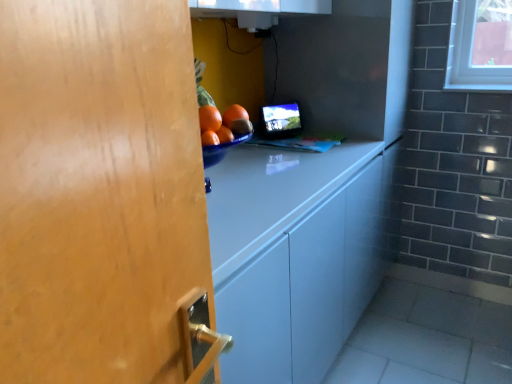
Question: Is point (287, 125) positioned closer to the camera than point (254, 170)?

Choices:
 (A) closer
 (B) farther

Answer: (B)

Question: Do you think matte black monitor at center is within white glossy cabinet at center, or outside of it?

Choices:
 (A) outside
 (B) inside

Answer: (A)

Question: Considering the relative positions of matte black monitor at center and white glossy cabinet at center in the image provided, is matte black monitor at center to the left or to the right of white glossy cabinet at center?

Choices:
 (A) left
 (B) right

Answer: (A)

Question: In terms of height, does white glossy cabinet at center look taller or shorter compared to matte black monitor at center?

Choices:
 (A) tall
 (B) short

Answer: (A)

Question: Is point (283, 367) closer or farther from the camera than point (297, 119)?

Choices:
 (A) farther
 (B) closer

Answer: (B)

Question: Considering the relative positions of white glossy cabinet at center and matte black monitor at center in the image provided, is white glossy cabinet at center to the left or to the right of matte black monitor at center?

Choices:
 (A) right
 (B) left

Answer: (A)

Question: In the image, is white glossy cabinet at center positioned in front of or behind matte black monitor at center?

Choices:
 (A) front
 (B) behind

Answer: (A)